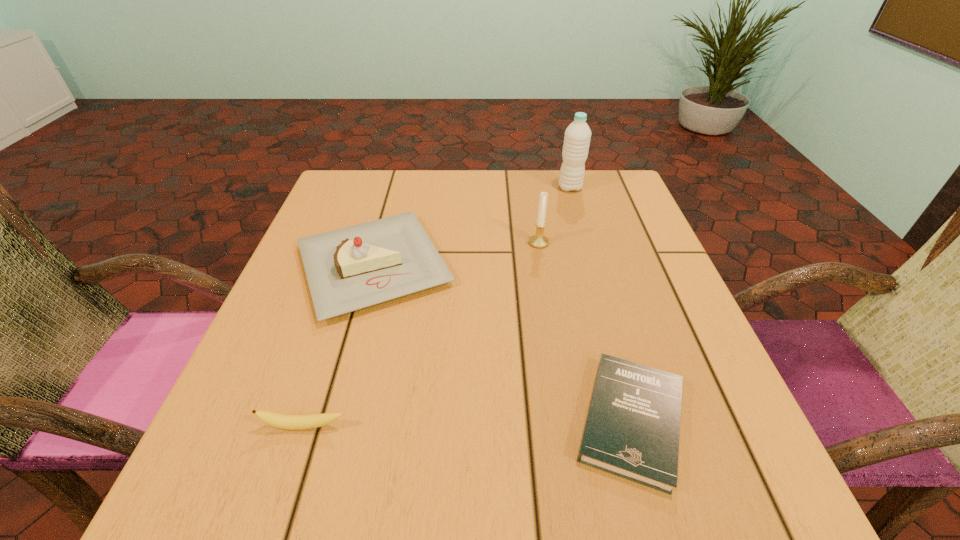
Image resolution: width=960 pixels, height=540 pixels. I want to click on object that is positioned at the near right corner, so click(632, 429).

I want to click on vacant region at the far edge, so click(457, 186).

Find the location of `vacant space at the near edge of the desktop`. vacant space at the near edge of the desktop is located at coordinates (485, 504).

This screenshot has width=960, height=540. In order to click on free space at the left edge of the desktop in this screenshot , I will do `click(325, 395)`.

Image resolution: width=960 pixels, height=540 pixels. Identify the location of vacant region at the near left corner of the desktop. (216, 481).

This screenshot has height=540, width=960. In order to click on free location at the far right corner of the desktop in this screenshot , I will do `click(633, 199)`.

Locate an element on the screen. The height and width of the screenshot is (540, 960). free spot between the water bottle and the banana is located at coordinates (437, 307).

Image resolution: width=960 pixels, height=540 pixels. What are the coordinates of `blank region between the cake and the banana` in the screenshot? It's located at (339, 346).

The image size is (960, 540). I want to click on unoccupied position between the water bottle and the shortest object, so click(600, 304).

I want to click on unoccupied position between the second tallest object and the book, so click(x=585, y=332).